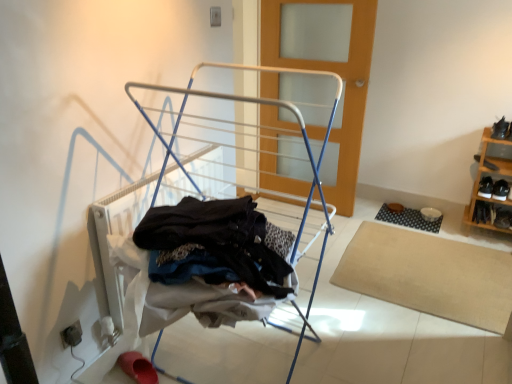
Where is `vacant point to the right of white metal drying rack at center`? The height and width of the screenshot is (384, 512). vacant point to the right of white metal drying rack at center is located at coordinates (377, 338).